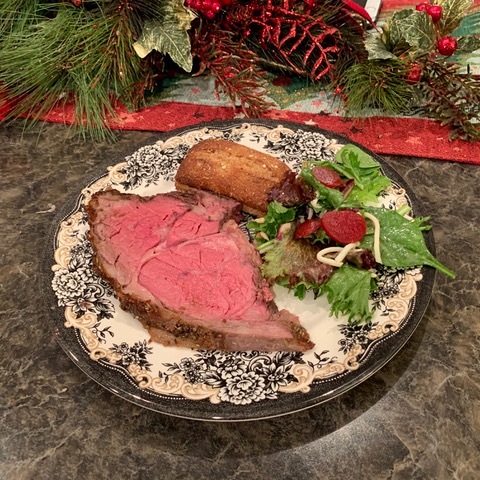
The width and height of the screenshot is (480, 480). Find the location of `tabletop`. tabletop is located at coordinates (17, 353).